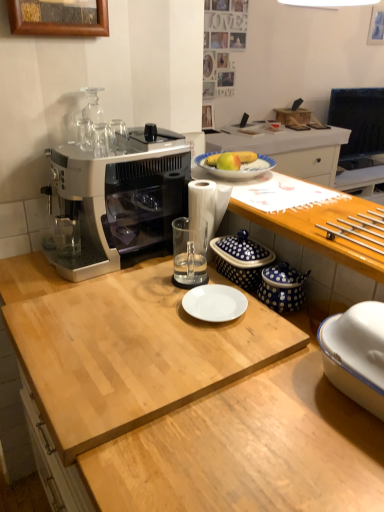
Question: Considering the relative positions of transparent glass at center, the 2th tableware positioned from the left, and blue polka dot ceramic container at center, arranged as the 2th appliance when viewed from the front, in the image provided, is transparent glass at center, the 2th tableware positioned from the left, to the left or to the right of blue polka dot ceramic container at center, arranged as the 2th appliance when viewed from the front,?

Choices:
 (A) right
 (B) left

Answer: (B)

Question: Considering the positions of point (201, 233) and point (264, 247), is point (201, 233) closer or farther from the camera than point (264, 247)?

Choices:
 (A) farther
 (B) closer

Answer: (A)

Question: Which of these objects is positioned closest to the blue dotted ceramic jars at right, which appears as the first appliance when viewed from the front?

Choices:
 (A) light wood cutting board at center, which is counted as the first desk, starting from the bottom
 (B) yellow matte apple at center
 (C) satin silver coffee maker at left
 (D) wooden picture frame at upper left
 (E) clear glass cups at upper left, the 1th tableware positioned from the top

Answer: (A)

Question: Estimate the real-world distances between objects in this image. Which object is farther from the blue dotted ceramic jars at right, positioned as the 2th appliance in back-to-front order?

Choices:
 (A) satin silver coffee maker at left
 (B) wooden at upper right, acting as the first desk starting from the top
 (C) clear glass cups at upper left, which is counted as the first tableware, starting from the left
 (D) transparent glass at center, the 2th tableware positioned from the left
 (E) wooden picture frame at upper left

Answer: (E)